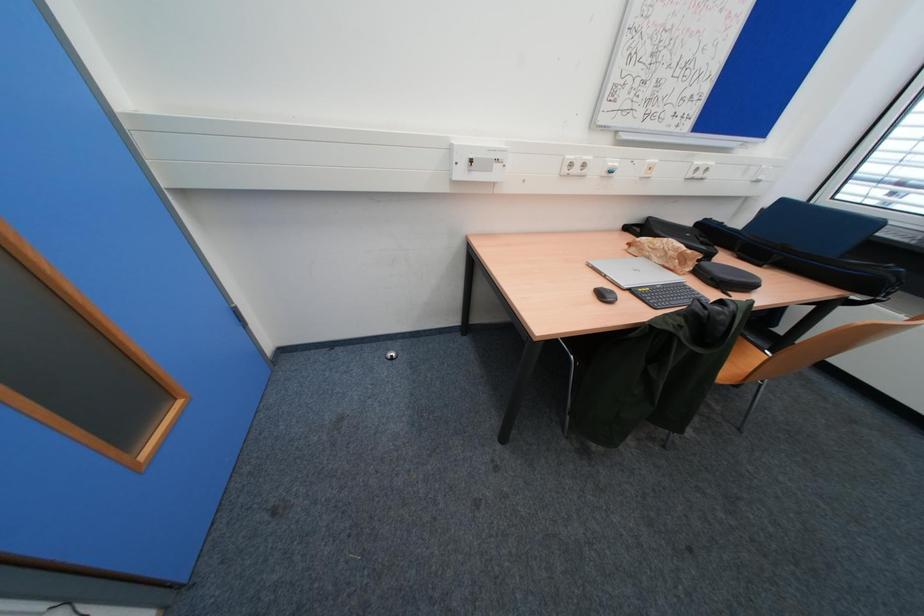
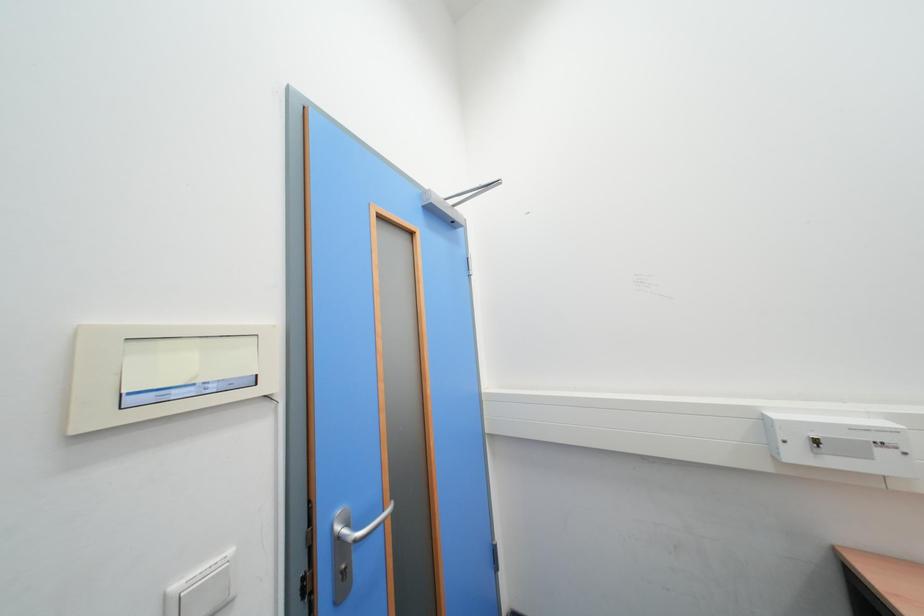
Looking at this image, the first image is from the beginning of the video and the second image is from the end. How did the camera likely rotate when shooting the video?

The camera's rotation is toward left-up.